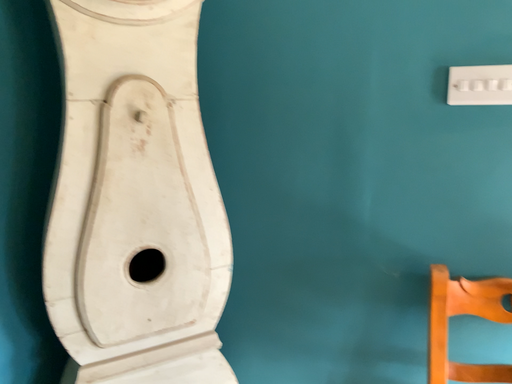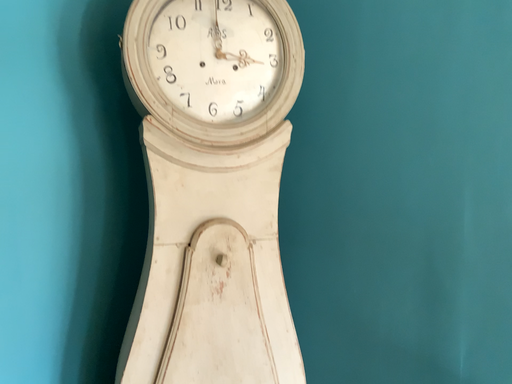
Question: Which way did the camera rotate in the video?

Choices:
 (A) rotated right
 (B) rotated left

Answer: (B)